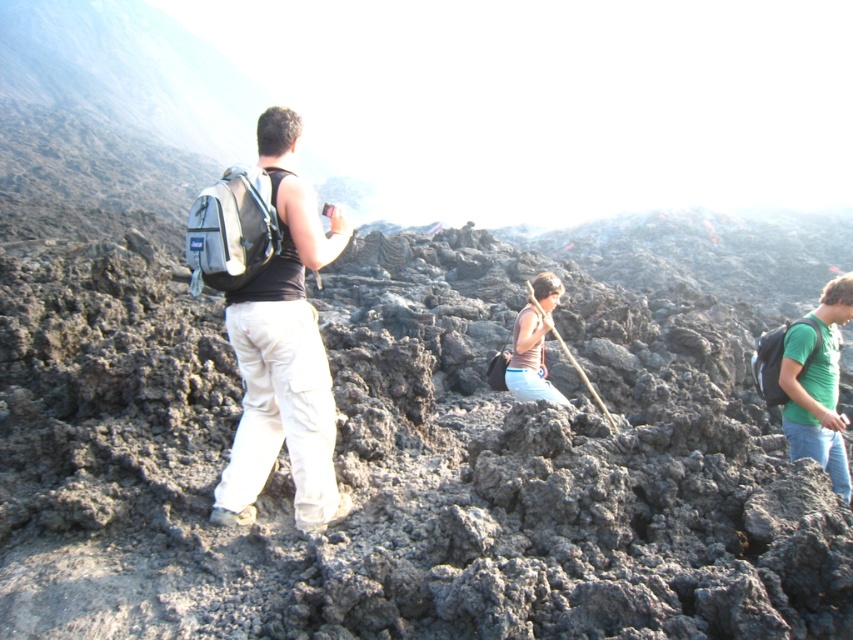
Can you confirm if matte black backpack at center is positioned above matte brown shirt at center?

Correct, matte black backpack at center is located above matte brown shirt at center.

Between matte black backpack at center and matte brown shirt at center, which one appears on the right side from the viewer's perspective?

Positioned to the right is matte brown shirt at center.

Where is `matte black backpack at center`? matte black backpack at center is located at coordinates (283, 349).

Where is `matte black backpack at center`? The height and width of the screenshot is (640, 853). matte black backpack at center is located at coordinates (283, 349).

Is green matte shirt at right below matte brown shirt at center?

Indeed, green matte shirt at right is positioned under matte brown shirt at center.

Where is `green matte shirt at right`? This screenshot has height=640, width=853. green matte shirt at right is located at coordinates (817, 385).

Locate an element on the screen. green matte shirt at right is located at coordinates (817, 385).

Is point (300, 209) positioned in front of point (805, 422)?

Yes, point (300, 209) is closer to viewer.

Can you confirm if matte black backpack at center is wider than green matte shirt at right?

Yes.

Locate an element on the screen. The height and width of the screenshot is (640, 853). matte black backpack at center is located at coordinates (283, 349).